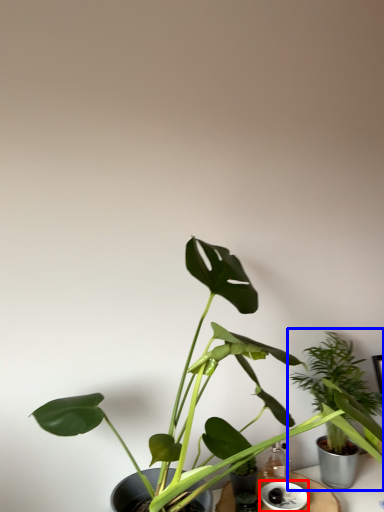
Question: Which object appears farthest to the camera in this image, saucer (highlighted by a red box) or houseplant (highlighted by a blue box)?

Choices:
 (A) saucer
 (B) houseplant

Answer: (B)